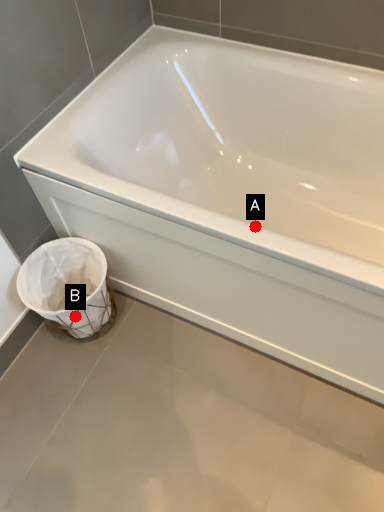
Question: Two points are circled on the image, labeled by A and B beside each circle. Which point is closer to the camera?

Choices:
 (A) A is closer
 (B) B is closer

Answer: (A)